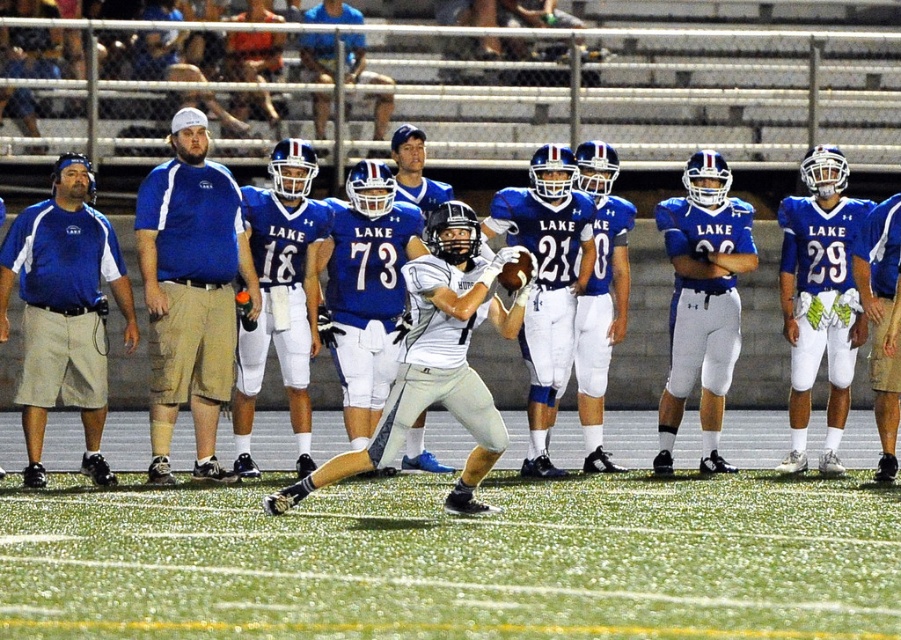
Which is more to the right, blue fabric shirt at left or white matte jersey at center?

white matte jersey at center is more to the right.

Can you confirm if blue fabric shirt at left is shorter than white matte jersey at center?

In fact, blue fabric shirt at left may be taller than white matte jersey at center.

Measure the distance between point [221,182] and camera.

17.09 meters

Locate an element on the screen. This screenshot has width=901, height=640. blue fabric shirt at left is located at coordinates click(x=190, y=291).

Describe the element at coordinates (456, 560) in the screenshot. The height and width of the screenshot is (640, 901). I see `green turf at center` at that location.

Describe the element at coordinates (456, 560) in the screenshot. I see `green turf at center` at that location.

At what (x,y) coordinates should I click in order to perform the action: click on green turf at center. Please return your answer as a coordinate pair (x, y). This screenshot has height=640, width=901. Looking at the image, I should click on pos(456,560).

Does blue matte uniform at center appear on the right side of matte blue helmet at upper center?

Yes, blue matte uniform at center is to the right of matte blue helmet at upper center.

Where is `blue matte uniform at center`? blue matte uniform at center is located at coordinates (643, 323).

Who is more distant from viewer, [43,164] or [317,61]?

Point [317,61]

Identify the location of blue matte uniform at center. (643, 323).